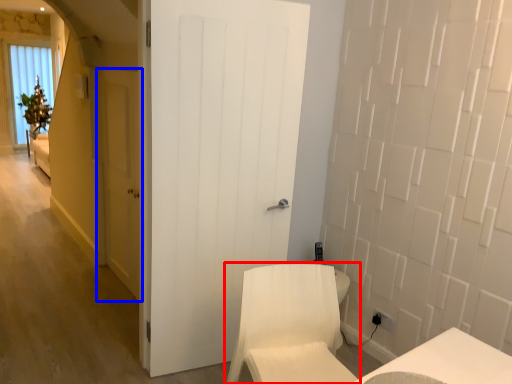
Question: Which object appears closest to the camera in this image, furniture (highlighted by a red box) or door (highlighted by a blue box)?

Choices:
 (A) furniture
 (B) door

Answer: (A)